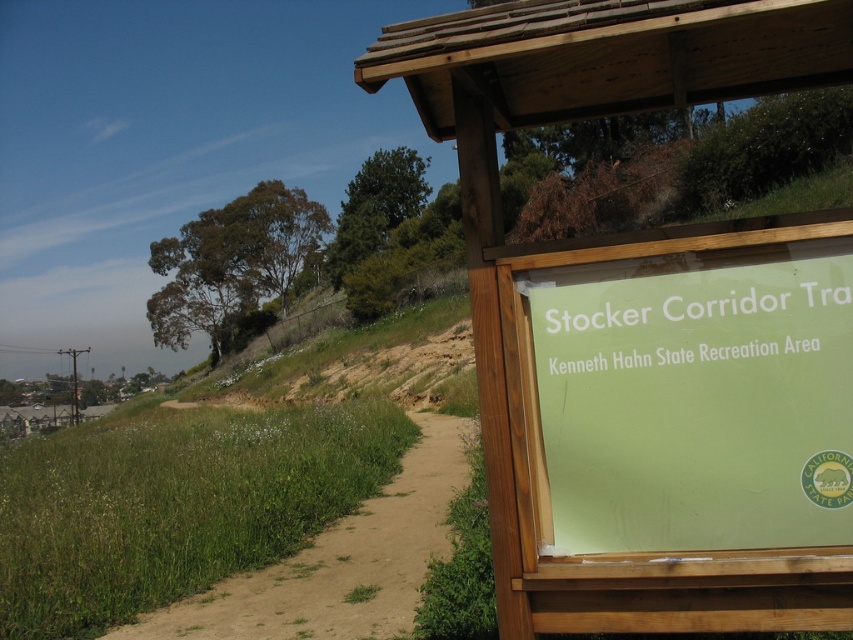
You are standing at the point labeled as point (688, 397) in the image. What object are you facing? Please answer with the object label from the scene description.

The point (688, 397) corresponds to the green matte sign at right, so you are facing the green matte sign at right.

You are planning to place a new sign next to the existing green matte sign at right and brown sandy dirt track at lower left. If the new sign must be wider than both existing objects, what should you do?

The green matte sign at right is narrower than the brown sandy dirt track at lower left. Therefore, the new sign must be wider than the brown sandy dirt track at lower left to satisfy the requirement.

You are standing at the center of the dirt path to the left of the wooden sign at right. Which direction should you walk to reach the hillside covered with grass?

Since the wooden sign at right is positioned at point (648, 330), you should walk towards the right side of the path to head toward the hillside covered with grass.